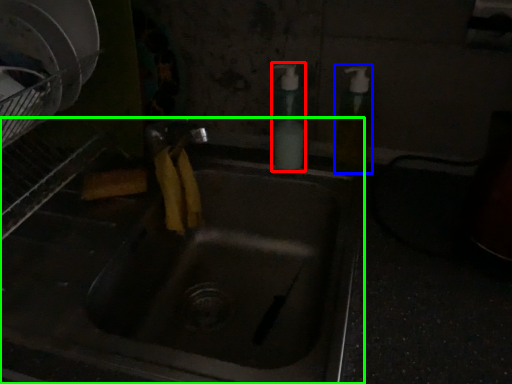
Question: Which is nearer to the soap dispenser (highlighted by a red box)? soap dispenser (highlighted by a blue box) or sink (highlighted by a green box).

Choices:
 (A) soap dispenser
 (B) sink

Answer: (A)